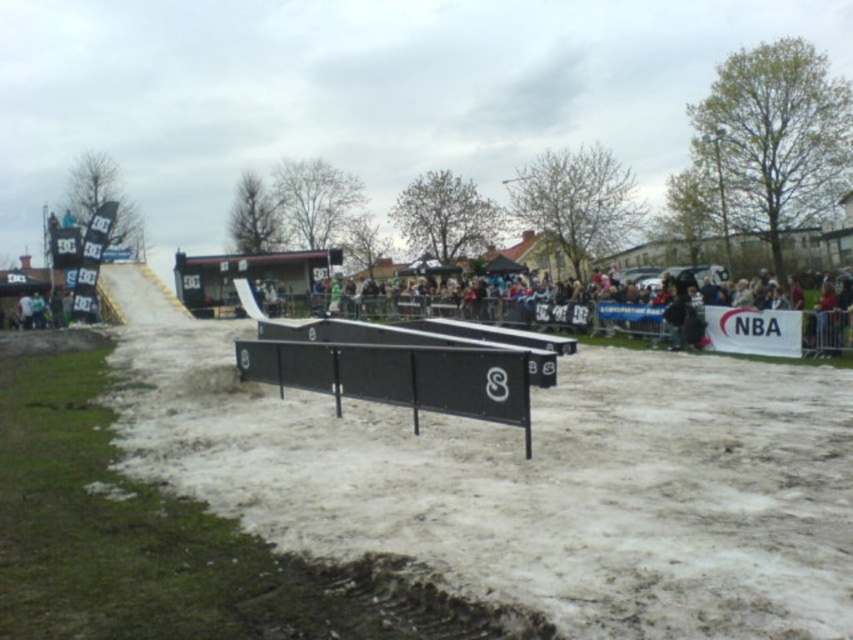
You are a skateboarder planning to perform a trick that requires a wide surface. You see the brown dirt track at lower left and the black matte ramp at center. Which one should you choose for your trick based on their widths?

The black matte ramp at center has a wider surface than the brown dirt track at lower left, so you should choose the black matte ramp at center for your trick.

You are a photographer positioned at the center of the skateboarding event. You want to take a photo that includes both point (709, 410) and point (589, 310). Which point should you focus on first to ensure both are in frame?

You should focus on point (709, 410) first because it is in front of point (589, 310), ensuring both are captured in the photo.

You are a skateboarder preparing to start a run. You see the brown dirt track at lower left and the black matte ramp at center. Which one should you approach first if you want to begin your run closest to where you are standing?

You should approach the brown dirt track at lower left first because it is closer to you than the black matte ramp at center.